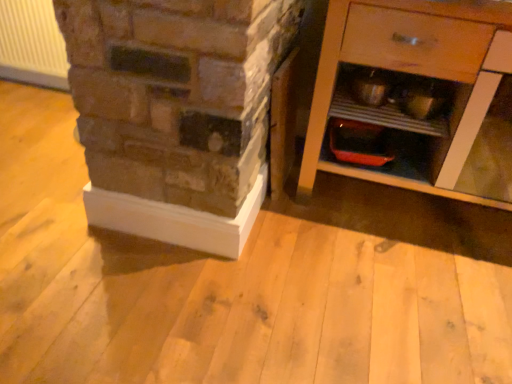
Question: Should I look upward or downward to see white plastic radiator at upper left?

Choices:
 (A) up
 (B) down

Answer: (A)

Question: Does wooden cabinet at right come in front of white plastic radiator at upper left?

Choices:
 (A) no
 (B) yes

Answer: (B)

Question: Considering the relative sizes of wooden cabinet at right and white plastic radiator at upper left in the image provided, is wooden cabinet at right taller than white plastic radiator at upper left?

Choices:
 (A) yes
 (B) no

Answer: (A)

Question: From the image's perspective, does wooden cabinet at right appear higher than white plastic radiator at upper left?

Choices:
 (A) yes
 (B) no

Answer: (B)

Question: From a real-world perspective, is wooden cabinet at right positioned over white plastic radiator at upper left based on gravity?

Choices:
 (A) yes
 (B) no

Answer: (A)

Question: Is wooden cabinet at right bigger than white plastic radiator at upper left?

Choices:
 (A) no
 (B) yes

Answer: (B)

Question: Is wooden cabinet at right not within white plastic radiator at upper left?

Choices:
 (A) yes
 (B) no

Answer: (A)

Question: Is white plastic radiator at upper left positioned beyond the bounds of wooden cabinet at right?

Choices:
 (A) no
 (B) yes

Answer: (B)

Question: Does white plastic radiator at upper left lie behind wooden cabinet at right?

Choices:
 (A) no
 (B) yes

Answer: (B)

Question: Is white plastic radiator at upper left positioned in front of wooden cabinet at right?

Choices:
 (A) no
 (B) yes

Answer: (A)

Question: Can you confirm if white plastic radiator at upper left is positioned to the right of wooden cabinet at right?

Choices:
 (A) yes
 (B) no

Answer: (B)

Question: From a real-world perspective, does white plastic radiator at upper left stand above wooden cabinet at right?

Choices:
 (A) no
 (B) yes

Answer: (A)

Question: Is white plastic radiator at upper left next to wooden cabinet at right and touching it?

Choices:
 (A) yes
 (B) no

Answer: (B)

Question: From the image's perspective, is wooden cabinet at right positioned above or below white plastic radiator at upper left?

Choices:
 (A) above
 (B) below

Answer: (B)